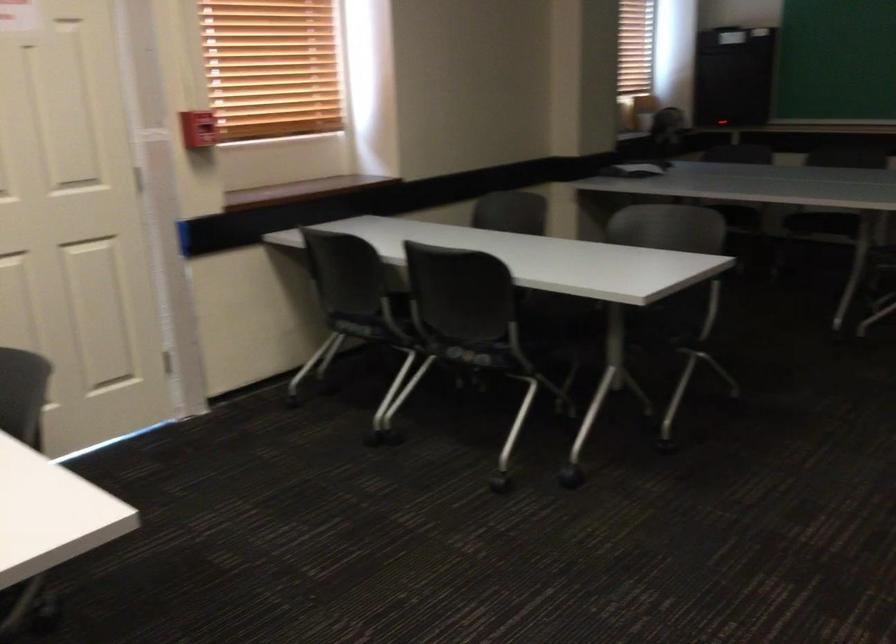
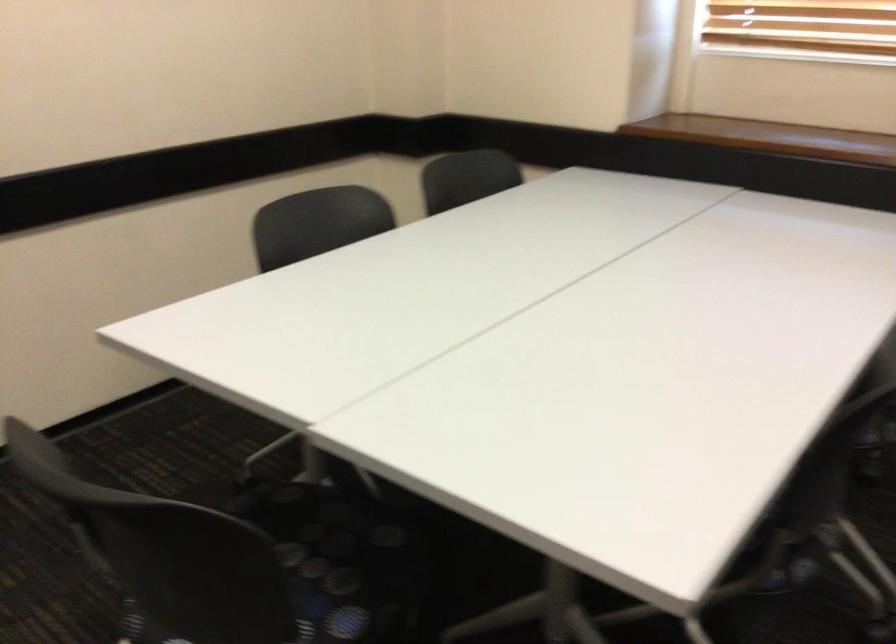
Based on the continuous images, in which direction is the camera rotating?

The camera's rotation is toward left-down.